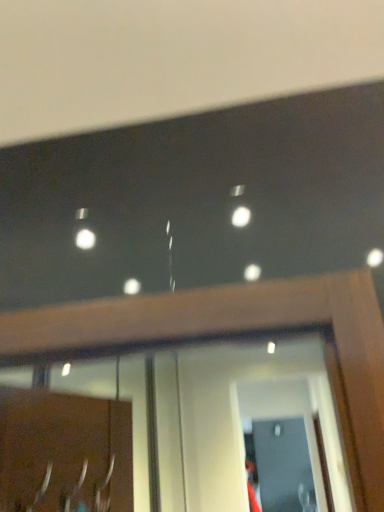
Question: In which direction should I rotate to look at transparent glass screen door at lower center, which is counted as the second screen door, starting from the back?

Choices:
 (A) left
 (B) right

Answer: (B)

Question: From the image's perspective, does transparent glass screen door at lower center, which appears as the first screen door when viewed from the front, appear lower than clear glass screen door at lower center, marked as the first screen door in a bottom-to-top arrangement?

Choices:
 (A) yes
 (B) no

Answer: (B)

Question: From a real-world perspective, is transparent glass screen door at lower center, arranged as the 1th screen door when viewed from the top, located beneath clear glass screen door at lower center, which appears as the 1th screen door when viewed from the back?

Choices:
 (A) yes
 (B) no

Answer: (B)

Question: Does transparent glass screen door at lower center, which is counted as the second screen door, starting from the back, appear on the right side of clear glass screen door at lower center, marked as the second screen door in a front-to-back arrangement?

Choices:
 (A) no
 (B) yes

Answer: (A)

Question: Does transparent glass screen door at lower center, the second screen door positioned from the bottom, come in front of clear glass screen door at lower center, which appears as the 1th screen door when viewed from the back?

Choices:
 (A) yes
 (B) no

Answer: (A)

Question: Does transparent glass screen door at lower center, arranged as the 1th screen door when viewed from the top, have a greater height compared to clear glass screen door at lower center, which appears as the 1th screen door when viewed from the back?

Choices:
 (A) yes
 (B) no

Answer: (B)

Question: Is transparent glass screen door at lower center, which appears as the first screen door when viewed from the front, positioned with its back to clear glass screen door at lower center, which appears as the 1th screen door when viewed from the back?

Choices:
 (A) yes
 (B) no

Answer: (A)

Question: Does silver metallic door handle at lower left have a larger size compared to clear glass screen door at lower center, marked as the first screen door in a bottom-to-top arrangement?

Choices:
 (A) no
 (B) yes

Answer: (A)

Question: Is silver metallic door handle at lower left looking in the opposite direction of clear glass screen door at lower center, marked as the first screen door in a bottom-to-top arrangement?

Choices:
 (A) yes
 (B) no

Answer: (B)

Question: Can you confirm if silver metallic door handle at lower left is positioned to the right of clear glass screen door at lower center, acting as the 2th screen door starting from the top?

Choices:
 (A) yes
 (B) no

Answer: (B)

Question: Is silver metallic door handle at lower left far away from clear glass screen door at lower center, marked as the second screen door in a front-to-back arrangement?

Choices:
 (A) no
 (B) yes

Answer: (B)

Question: Does silver metallic door handle at lower left have a smaller size compared to clear glass screen door at lower center, acting as the 2th screen door starting from the top?

Choices:
 (A) yes
 (B) no

Answer: (A)

Question: Does silver metallic door handle at lower left turn towards clear glass screen door at lower center, which appears as the 1th screen door when viewed from the back?

Choices:
 (A) yes
 (B) no

Answer: (B)

Question: Is clear glass screen door at lower center, marked as the second screen door in a front-to-back arrangement, looking in the opposite direction of transparent glass screen door at lower center, arranged as the 1th screen door when viewed from the top?

Choices:
 (A) no
 (B) yes

Answer: (A)